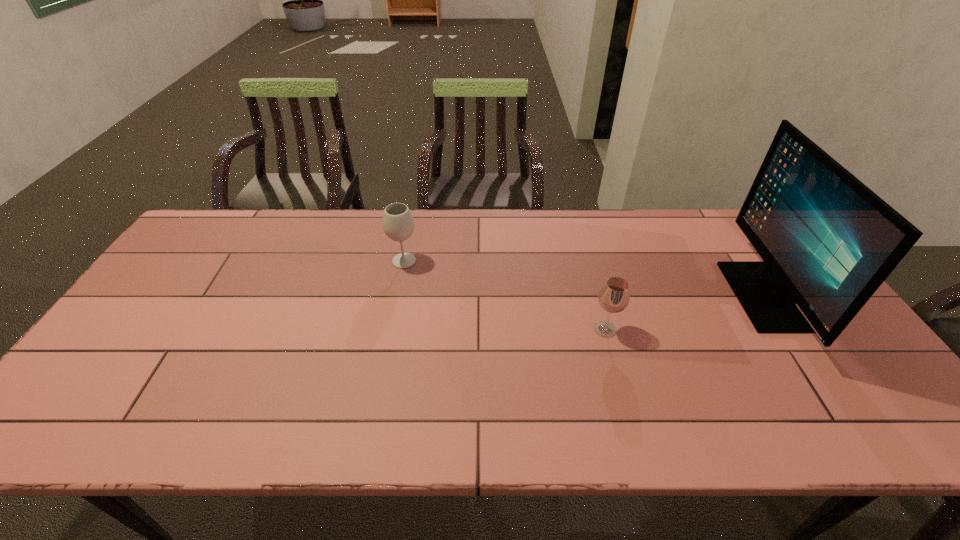
Where is `vacant area that lies between the nearer wineglass and the leftmost object`? vacant area that lies between the nearer wineglass and the leftmost object is located at coordinates (505, 295).

Identify the location of object that can be found as the second closest to the nearer wineglass. Image resolution: width=960 pixels, height=540 pixels. (398, 224).

Identify which object is the nearest to the leftmost object. Please provide its 2D coordinates. Your answer should be formatted as a tuple, i.e. [(x, y)], where the tuple contains the x and y coordinates of a point satisfying the conditions above.

[(614, 297)]

This screenshot has height=540, width=960. What are the coordinates of `free spot that satisfies the following two spatial constraints: 1. on the screen side of the rightmost object; 2. on the front side of the shortest object` in the screenshot? It's located at 786,329.

Identify the location of vacant space that satisfies the following two spatial constraints: 1. on the front side of the farther wineglass; 2. on the left side of the nearer wineglass. The image size is (960, 540). (391, 329).